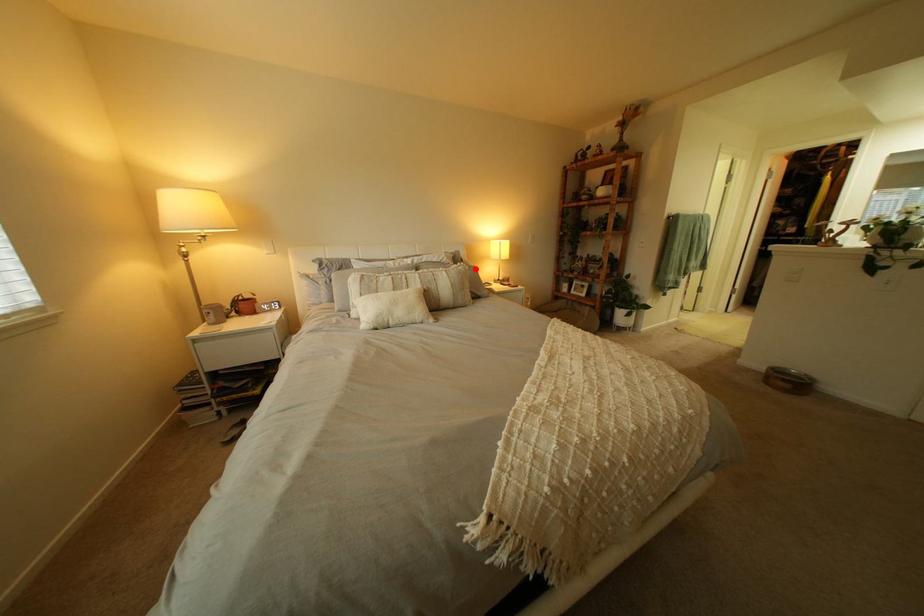
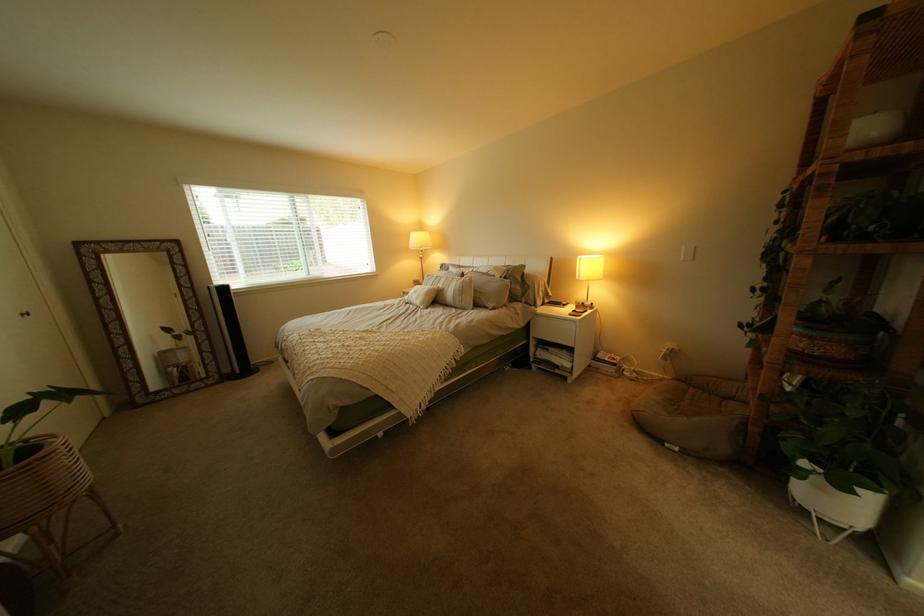
Where in the second image is the point corresponding to the highlighted location from the first image?

(482, 280)